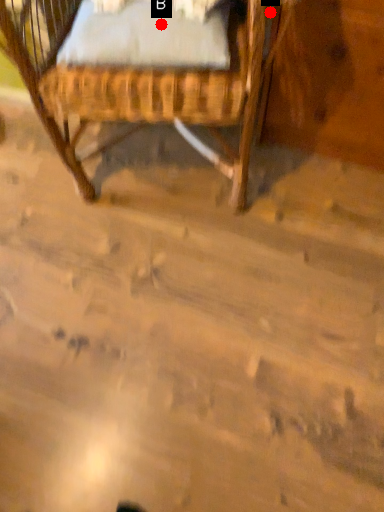
Question: Two points are circled on the image, labeled by A and B beside each circle. Which point is further to the camera?

Choices:
 (A) A is further
 (B) B is further

Answer: (A)